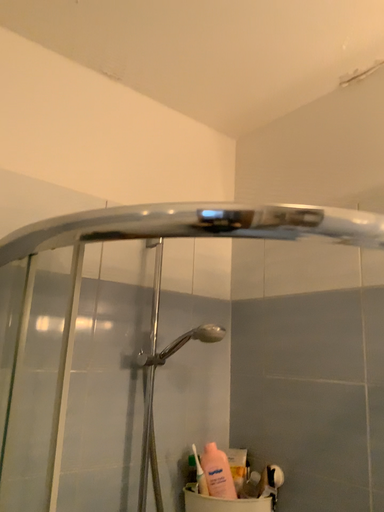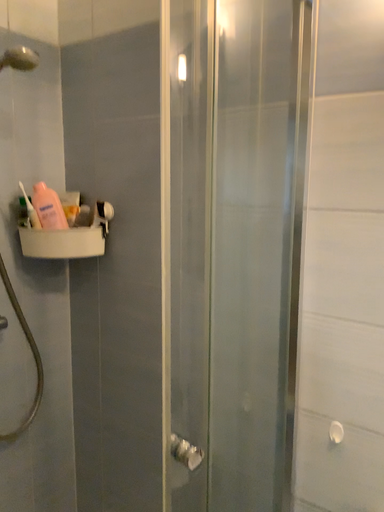
Question: How did the camera likely rotate when shooting the video?

Choices:
 (A) rotated upward
 (B) rotated downward

Answer: (B)